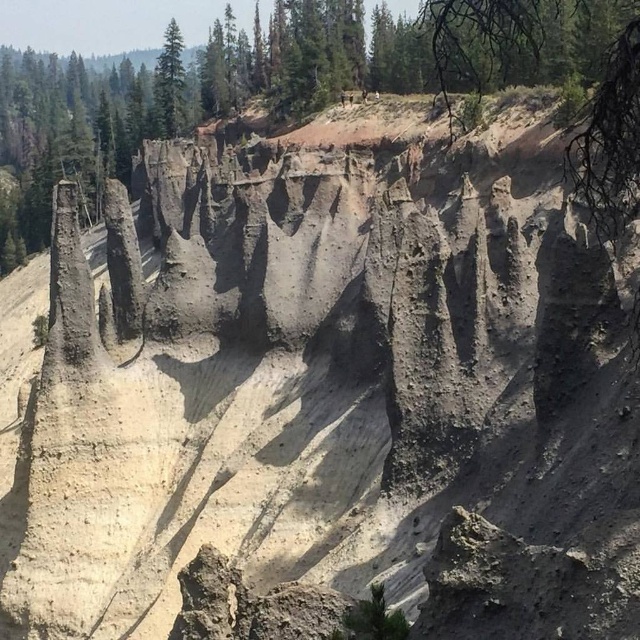
Who is taller, dull gray rock formation at center or green matte tree at upper center?

dull gray rock formation at center is taller.

Is dull gray rock formation at center positioned before green matte tree at upper center?

Yes, dull gray rock formation at center is in front of green matte tree at upper center.

Measure the distance between point (467,0) and camera.

Point (467,0) is 302.91 feet from camera.

The image size is (640, 640). Identify the location of dull gray rock formation at center. (400, 52).